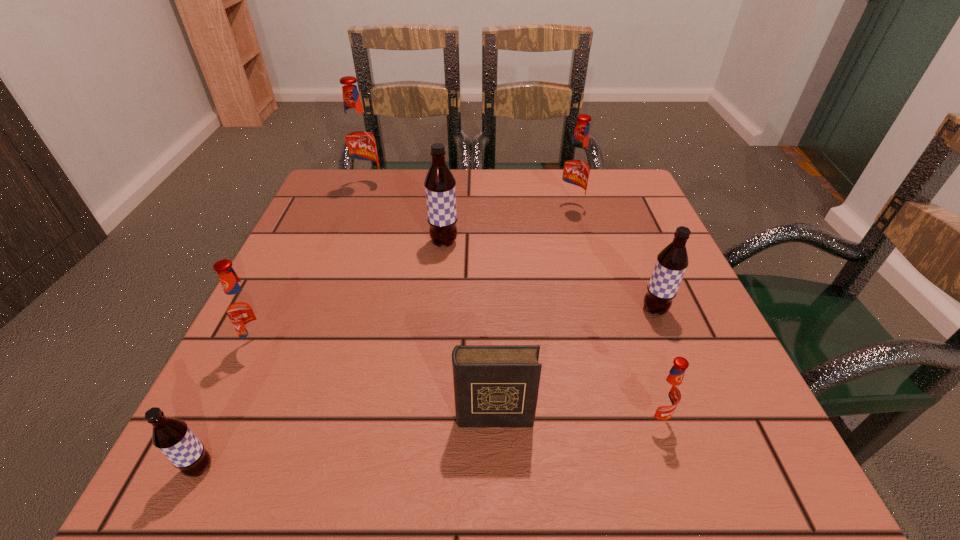
Choose which brown root beer is the nearest neighbor to the smallest red root beer. Please provide its 2D coordinates. Your answer should be formatted as a tuple, i.e. [(x, y)], where the tuple contains the x and y coordinates of a point satisfying the conditions above.

[(672, 261)]

Locate an element on the screen. The height and width of the screenshot is (540, 960). free space in the image that satisfies the following two spatial constraints: 1. on the back side of the nearest red root beer; 2. on the left side of the rightmost root beer is located at coordinates (619, 309).

This screenshot has height=540, width=960. Find the location of `free spot that satisfies the following two spatial constraints: 1. on the front cover of the smallest red root beer; 2. on the right side of the fourth object from right to left`. free spot that satisfies the following two spatial constraints: 1. on the front cover of the smallest red root beer; 2. on the right side of the fourth object from right to left is located at coordinates (494, 419).

The height and width of the screenshot is (540, 960). I want to click on free space in the image that satisfies the following two spatial constraints: 1. on the back side of the second biggest red root beer; 2. on the left side of the leftmost brown root beer, so click(x=324, y=208).

I want to click on free location that satisfies the following two spatial constraints: 1. on the front cover of the nearest red root beer; 2. on the right side of the dark diary, so click(x=494, y=419).